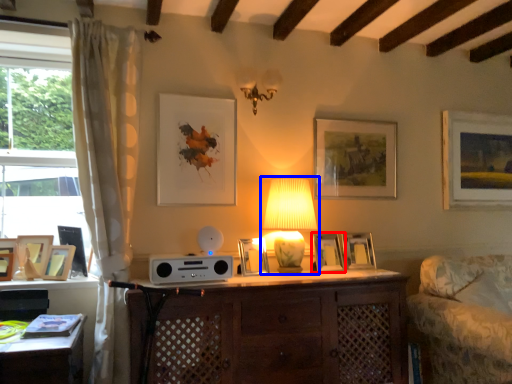
Question: Which object is closer to the camera taking this photo, picture frame (highlighted by a red box) or lamp (highlighted by a blue box)?

Choices:
 (A) picture frame
 (B) lamp

Answer: (B)